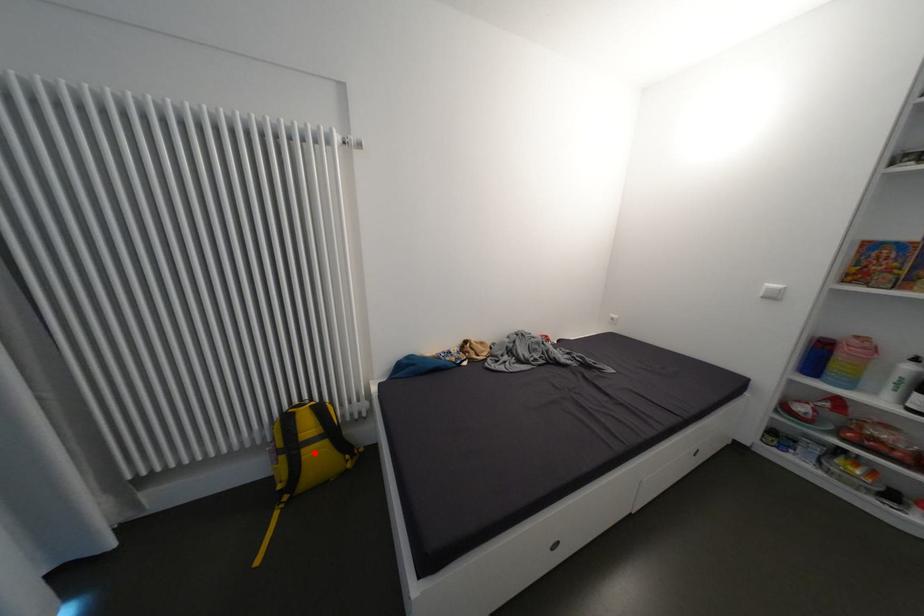
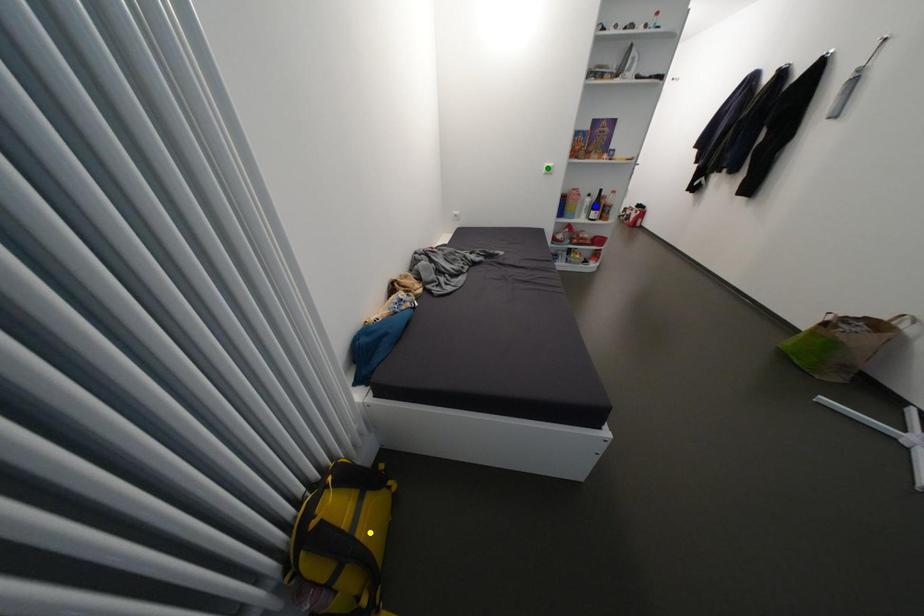
Question: I am providing you with two images of the same scene from different viewpoints. A red point is marked on the first image. You are given multiple points on the second image. Which mark in image 2 goes with the point in image 1?

Choices:
 (A) green point
 (B) blue point
 (C) yellow point

Answer: (C)